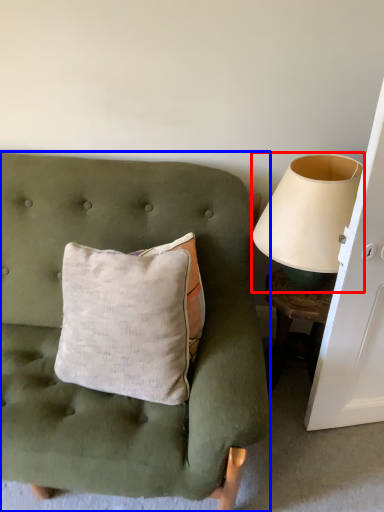
Question: Among these objects, which one is nearest to the camera, table lamp (highlighted by a red box) or furniture (highlighted by a blue box)?

Choices:
 (A) table lamp
 (B) furniture

Answer: (B)